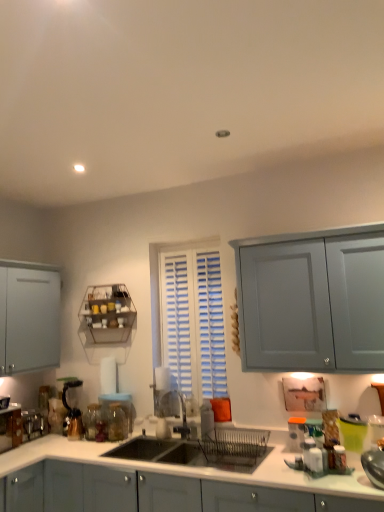
Where is `free space on the front side of transparent glass jar at lower left, the second glass jar viewed from the right`? The image size is (384, 512). free space on the front side of transparent glass jar at lower left, the second glass jar viewed from the right is located at coordinates (92, 449).